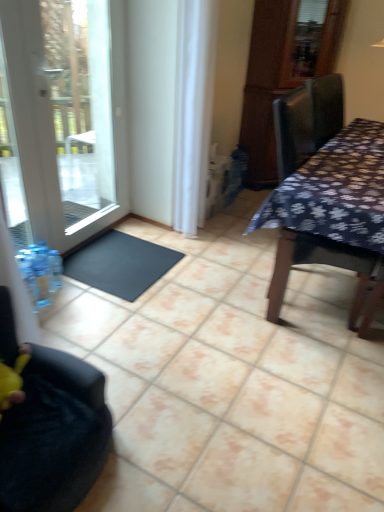
The width and height of the screenshot is (384, 512). Identify the location of vacant region to the left of dark floral fabric table at right. (215, 279).